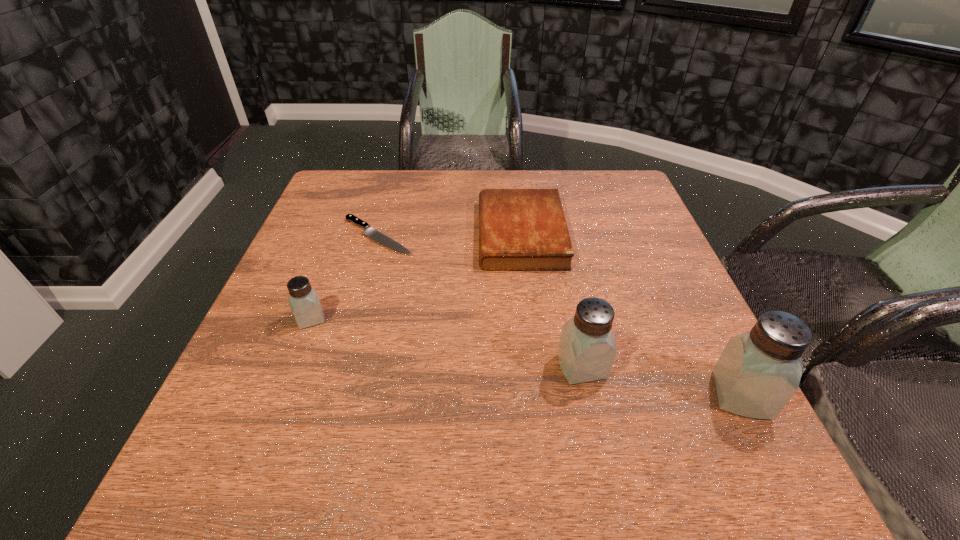
If equal spacing is the goal by inserting an additional saltshaker among them, please point out a vacant space for this new saltshaker. Please provide its 2D coordinates. Your answer should be formatted as a tuple, i.e. [(x, y)], where the tuple contains the x and y coordinates of a point satisfying the conditions above.

[(440, 341)]